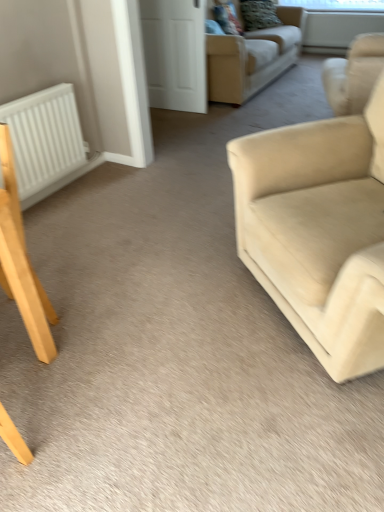
The height and width of the screenshot is (512, 384). What do you see at coordinates (258, 14) in the screenshot?
I see `velvet textured pillow at upper center` at bounding box center [258, 14].

Image resolution: width=384 pixels, height=512 pixels. What do you see at coordinates (316, 234) in the screenshot?
I see `beige fabric couch at right, the second studio couch when ordered from back to front` at bounding box center [316, 234].

The width and height of the screenshot is (384, 512). What do you see at coordinates (337, 23) in the screenshot?
I see `transparent glass window screen at upper center, acting as the 1th window screen starting from the bottom` at bounding box center [337, 23].

What is the approximate height of transparent glass window screen at upper center, acting as the second window screen starting from the top?

The height of transparent glass window screen at upper center, acting as the second window screen starting from the top, is 17.74 inches.

Image resolution: width=384 pixels, height=512 pixels. Find the location of `transparent plastic window screen at upper center, marked as the 1th window screen in a top-to-bottom arrangement`. transparent plastic window screen at upper center, marked as the 1th window screen in a top-to-bottom arrangement is located at coordinates [x=336, y=5].

The width and height of the screenshot is (384, 512). What do you see at coordinates (336, 5) in the screenshot?
I see `transparent plastic window screen at upper center, which is the second window screen from bottom to top` at bounding box center [336, 5].

What do you see at coordinates (252, 57) in the screenshot?
I see `beige fabric couch at upper center, marked as the first studio couch in a back-to-front arrangement` at bounding box center [252, 57].

Where is `beige fabric couch at upper center, which is the second studio couch from front to back`? This screenshot has height=512, width=384. beige fabric couch at upper center, which is the second studio couch from front to back is located at coordinates (252, 57).

Identify the location of velvet textured pillow at upper center. The image size is (384, 512). (258, 14).

How much distance is there between white matte door at upper center and beige fabric couch at upper center, which is the second studio couch in bottom-to-top order?

A distance of 53.77 centimeters exists between white matte door at upper center and beige fabric couch at upper center, which is the second studio couch in bottom-to-top order.

Choose the correct answer: Is white matte door at upper center inside beige fabric couch at upper center, which is the second studio couch in bottom-to-top order, or outside it?

white matte door at upper center is spatially situated outside beige fabric couch at upper center, which is the second studio couch in bottom-to-top order.

From the image's perspective, which is above, white matte door at upper center or beige fabric couch at upper center, which is the second studio couch from front to back?

From the image's view, beige fabric couch at upper center, which is the second studio couch from front to back, is above.

From the image's perspective, does light brown wooden chair at lower left appear lower than white matte door at upper center?

Correct, light brown wooden chair at lower left appears lower than white matte door at upper center in the image.

Is light brown wooden chair at lower left oriented towards white matte door at upper center?

No, light brown wooden chair at lower left is not turned towards white matte door at upper center.

Which is more to the right, light brown wooden chair at lower left or white matte door at upper center?

Positioned to the right is white matte door at upper center.

Are transparent plastic window screen at upper center, marked as the 1th window screen in a top-to-bottom arrangement, and white matte door at upper center far apart?

Yes, transparent plastic window screen at upper center, marked as the 1th window screen in a top-to-bottom arrangement, and white matte door at upper center are quite far apart.

Which is more to the right, transparent plastic window screen at upper center, which is the second window screen from bottom to top, or white matte door at upper center?

transparent plastic window screen at upper center, which is the second window screen from bottom to top.

From a real-world perspective, who is located higher, transparent plastic window screen at upper center, marked as the 1th window screen in a top-to-bottom arrangement, or white matte door at upper center?

transparent plastic window screen at upper center, marked as the 1th window screen in a top-to-bottom arrangement.

Is transparent plastic window screen at upper center, marked as the 1th window screen in a top-to-bottom arrangement, positioned beyond the bounds of white matte door at upper center?

Yes.

Considering the relative sizes of white matte door at upper center and transparent plastic window screen at upper center, which is the second window screen from bottom to top, in the image provided, is white matte door at upper center thinner than transparent plastic window screen at upper center, which is the second window screen from bottom to top,?

Yes, white matte door at upper center is thinner than transparent plastic window screen at upper center, which is the second window screen from bottom to top.

Is the position of white matte door at upper center more distant than that of transparent plastic window screen at upper center, which is the second window screen from bottom to top?

No.

Who is taller, white matte door at upper center or transparent plastic window screen at upper center, which is the second window screen from bottom to top?

white matte door at upper center.

Who is taller, beige fabric couch at upper center, which is the second studio couch from front to back, or white matte door at upper center?

Standing taller between the two is white matte door at upper center.

From the image's perspective, which one is positioned higher, beige fabric couch at upper center, which is the second studio couch in bottom-to-top order, or white matte door at upper center?

beige fabric couch at upper center, which is the second studio couch in bottom-to-top order, is shown above in the image.

Is beige fabric couch at upper center, which appears as the first studio couch when viewed from the top, completely or partially outside of white matte door at upper center?

Absolutely, beige fabric couch at upper center, which appears as the first studio couch when viewed from the top, is external to white matte door at upper center.

From the image's perspective, between transparent plastic window screen at upper center, which is the second window screen from bottom to top, and beige fabric couch at right, the second studio couch when ordered from back to front, who is located below?

beige fabric couch at right, the second studio couch when ordered from back to front, appears lower in the image.

How many degrees apart are the facing directions of transparent plastic window screen at upper center, marked as the 1th window screen in a top-to-bottom arrangement, and beige fabric couch at right, the first studio couch from the bottom?

43.7 degrees separate the facing orientations of transparent plastic window screen at upper center, marked as the 1th window screen in a top-to-bottom arrangement, and beige fabric couch at right, the first studio couch from the bottom.

From a real-world perspective, relative to beige fabric couch at right, the second studio couch positioned from the top, is transparent plastic window screen at upper center, marked as the 1th window screen in a top-to-bottom arrangement, vertically above or below?

Clearly, from a real-world perspective, transparent plastic window screen at upper center, marked as the 1th window screen in a top-to-bottom arrangement, is above beige fabric couch at right, the second studio couch positioned from the top.

Which studio couch is the 1st one when counting from the left side of the transparent plastic window screen at upper center, which is the second window screen from bottom to top? Please provide its 2D coordinates.

[(316, 234)]

Is point (264, 20) closer to viewer compared to point (343, 3)?

Yes.

Does velvet textured pillow at upper center touch transparent plastic window screen at upper center, which is the second window screen from bottom to top?

velvet textured pillow at upper center and transparent plastic window screen at upper center, which is the second window screen from bottom to top, are clearly separated.

I want to click on pillow below the transparent plastic window screen at upper center, marked as the 1th window screen in a top-to-bottom arrangement (from the image's perspective), so click(258, 14).

How different are the orientations of velvet textured pillow at upper center and transparent plastic window screen at upper center, marked as the 1th window screen in a top-to-bottom arrangement, in degrees?

47.1 degrees.

Find the location of a particular element. The width and height of the screenshot is (384, 512). glass door that appears on the left of beige fabric couch at upper center, marked as the first studio couch in a back-to-front arrangement is located at coordinates (175, 54).

The width and height of the screenshot is (384, 512). Find the location of `chair in front of the white matte door at upper center`. chair in front of the white matte door at upper center is located at coordinates (21, 261).

From the image, which object appears to be nearer to beige fabric couch at right, the second studio couch when ordered from back to front, transparent glass window screen at upper center, acting as the 1th window screen starting from the bottom, or white matte door at upper center?

white matte door at upper center.

When comparing their distances from velvet textured pillow at upper center, does beige fabric couch at upper center, which is the second studio couch from front to back, or transparent glass window screen at upper center, acting as the second window screen starting from the top, seem closer?

Among the two, beige fabric couch at upper center, which is the second studio couch from front to back, is located nearer to velvet textured pillow at upper center.

From the image, which object appears to be nearer to white matte radiator at left, white matte door at upper center or transparent plastic window screen at upper center, which is the second window screen from bottom to top?

white matte door at upper center is closer to white matte radiator at left.

Considering their positions, is white matte radiator at left positioned closer to beige fabric couch at upper center, which appears as the first studio couch when viewed from the top, than beige fabric couch at right, the second studio couch when ordered from back to front?

white matte radiator at left is closer to beige fabric couch at upper center, which appears as the first studio couch when viewed from the top.

Based on their spatial positions, is white matte door at upper center or transparent glass window screen at upper center, acting as the second window screen starting from the top, further from beige fabric couch at upper center, marked as the first studio couch in a back-to-front arrangement?

transparent glass window screen at upper center, acting as the second window screen starting from the top, lies further to beige fabric couch at upper center, marked as the first studio couch in a back-to-front arrangement, than the other object.

Which object lies nearer to the anchor point velvet textured pillow at upper center, white matte door at upper center or transparent glass window screen at upper center, acting as the second window screen starting from the top?

transparent glass window screen at upper center, acting as the second window screen starting from the top, lies closer to velvet textured pillow at upper center than the other object.

Estimate the real-world distances between objects in this image. Which object is closer to white matte radiator at left, beige fabric couch at right, the second studio couch positioned from the top, or velvet textured pillow at upper center?

beige fabric couch at right, the second studio couch positioned from the top, is positioned closer to the anchor white matte radiator at left.

Which object lies further to the anchor point velvet textured pillow at upper center, light brown wooden chair at lower left or transparent plastic window screen at upper center, which is the second window screen from bottom to top?

The object further to velvet textured pillow at upper center is light brown wooden chair at lower left.

This screenshot has height=512, width=384. What are the coordinates of `glass door positioned between white matte radiator at left and transparent plastic window screen at upper center, marked as the 1th window screen in a top-to-bottom arrangement, from near to far` in the screenshot? It's located at (175, 54).

You are a GUI agent. You are given a task and a screenshot of the screen. Output one action in this format:
    pyautogui.click(x=<x>, y=<y>)
    Task: Click on the glass door positioned between light brown wooden chair at lower left and velvet textured pillow at upper center from near to far
    The image size is (384, 512).
    Given the screenshot: What is the action you would take?
    pyautogui.click(x=175, y=54)

The image size is (384, 512). What are the coordinates of `glass door between beige fabric couch at upper center, which is the second studio couch in bottom-to-top order, and white matte radiator at left from top to bottom` in the screenshot? It's located at (175, 54).

Identify the location of pillow located between beige fabric couch at upper center, which is the second studio couch in bottom-to-top order, and transparent plastic window screen at upper center, marked as the 1th window screen in a top-to-bottom arrangement, in the depth direction. tap(258, 14).